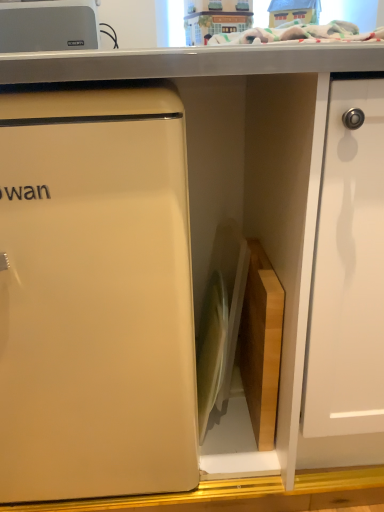
Describe the element at coordinates (215, 18) in the screenshot. Image resolution: width=384 pixels, height=512 pixels. I see `matte plastic toy house at upper center` at that location.

The image size is (384, 512). I want to click on silver metallic toaster at upper left, the 2th appliance positioned from the right, so click(48, 26).

Where is `matte plastic toy house at upper center`? Image resolution: width=384 pixels, height=512 pixels. matte plastic toy house at upper center is located at coordinates (215, 18).

Considering the sizes of matte white refrigerator at left and silver metallic toaster at upper left, which ranks as the first appliance in top-to-bottom order, in the image, is matte white refrigerator at left wider or thinner than silver metallic toaster at upper left, which ranks as the first appliance in top-to-bottom order,?

matte white refrigerator at left is wider than silver metallic toaster at upper left, which ranks as the first appliance in top-to-bottom order.

Which is nearer, (181,130) or (84,3)?

Positioned in front is point (181,130).

Considering the sizes of matte white refrigerator at left and silver metallic toaster at upper left, which ranks as the first appliance in top-to-bottom order, in the image, is matte white refrigerator at left bigger or smaller than silver metallic toaster at upper left, which ranks as the first appliance in top-to-bottom order,?

matte white refrigerator at left is bigger than silver metallic toaster at upper left, which ranks as the first appliance in top-to-bottom order.

Is matte white refrigerator at left further to the viewer compared to silver metallic toaster at upper left, the second appliance in the bottom-to-top sequence?

No, it is in front of silver metallic toaster at upper left, the second appliance in the bottom-to-top sequence.

From the image's perspective, is matte plastic toy house at upper center under matte white refrigerator at left?

No.

At what (x,y) coordinates should I click in order to perform the action: click on toy above the matte white refrigerator at left (from the image's perspective). Please return your answer as a coordinate pair (x, y). Looking at the image, I should click on (215, 18).

Is matte plastic toy house at upper center not within matte white refrigerator at left?

Yes.

Where is `refrigerator above the white glossy cutting board at center, the 2th appliance positioned from the left (from the image's perspective)`? The image size is (384, 512). refrigerator above the white glossy cutting board at center, the 2th appliance positioned from the left (from the image's perspective) is located at coordinates (95, 296).

Considering the relative sizes of matte white refrigerator at left and white glossy cutting board at center, which appears as the first appliance when ordered from the bottom, in the image provided, is matte white refrigerator at left shorter than white glossy cutting board at center, which appears as the first appliance when ordered from the bottom,?

Incorrect, the height of matte white refrigerator at left does not fall short of that of white glossy cutting board at center, which appears as the first appliance when ordered from the bottom.

Considering the sizes of objects matte white refrigerator at left and white glossy cutting board at center, the 2th appliance positioned from the top, in the image provided, who is bigger, matte white refrigerator at left or white glossy cutting board at center, the 2th appliance positioned from the top,?

With larger size is matte white refrigerator at left.

Which object is further away from the camera, white glossy cutting board at center, the 2th appliance positioned from the top, or silver metallic toaster at upper left, which ranks as the first appliance in top-to-bottom order?

silver metallic toaster at upper left, which ranks as the first appliance in top-to-bottom order, is more distant.

How different are the orientations of white glossy cutting board at center, the 2th appliance positioned from the top, and silver metallic toaster at upper left, the 2th appliance positioned from the right, in degrees?

0.103 degrees.

Is white glossy cutting board at center, the 2th appliance positioned from the top, bigger or smaller than silver metallic toaster at upper left, which ranks as the first appliance in top-to-bottom order?

In the image, white glossy cutting board at center, the 2th appliance positioned from the top, appears to be larger than silver metallic toaster at upper left, which ranks as the first appliance in top-to-bottom order.

From a real-world perspective, is white glossy cutting board at center, acting as the first appliance starting from the right, on silver metallic toaster at upper left, the second appliance in the bottom-to-top sequence?

Actually, white glossy cutting board at center, acting as the first appliance starting from the right, is physically below silver metallic toaster at upper left, the second appliance in the bottom-to-top sequence, in the real world.

Is point (211, 29) in front of point (240, 286)?

No, (211, 29) is further to viewer.

Which of these two, matte plastic toy house at upper center or white glossy cutting board at center, which appears as the first appliance when ordered from the bottom, stands shorter?

Standing shorter between the two is matte plastic toy house at upper center.

Considering the sizes of matte plastic toy house at upper center and white glossy cutting board at center, which appears as the first appliance when ordered from the bottom, in the image, is matte plastic toy house at upper center wider or thinner than white glossy cutting board at center, which appears as the first appliance when ordered from the bottom,?

In the image, matte plastic toy house at upper center appears to be more narrow than white glossy cutting board at center, which appears as the first appliance when ordered from the bottom.

In the image, is matte plastic toy house at upper center positioned in front of or behind silver metallic toaster at upper left, which ranks as the first appliance in top-to-bottom order?

Clearly, matte plastic toy house at upper center is behind silver metallic toaster at upper left, which ranks as the first appliance in top-to-bottom order.

Is matte plastic toy house at upper center positioned far away from silver metallic toaster at upper left, the second appliance in the bottom-to-top sequence?

matte plastic toy house at upper center is near silver metallic toaster at upper left, the second appliance in the bottom-to-top sequence, not far away.

Does point (199, 39) appear closer or farther from the camera than point (1, 41)?

Point (199, 39) appears to be farther away from the viewer than point (1, 41).

Can you confirm if matte plastic toy house at upper center is thinner than silver metallic toaster at upper left, the first appliance in the left-to-right sequence?

No, matte plastic toy house at upper center is not thinner than silver metallic toaster at upper left, the first appliance in the left-to-right sequence.

From the image's perspective, who appears lower, silver metallic toaster at upper left, the first appliance in the left-to-right sequence, or matte white refrigerator at left?

From the image's view, matte white refrigerator at left is below.

Which of these two, silver metallic toaster at upper left, which ranks as the first appliance in top-to-bottom order, or matte white refrigerator at left, stands shorter?

With less height is silver metallic toaster at upper left, which ranks as the first appliance in top-to-bottom order.

Which point is more forward, [41,34] or [144,169]?

The point [144,169] is in front.

At what (x,y) coordinates should I click in order to perform the action: click on refrigerator that is under the silver metallic toaster at upper left, the first appliance in the left-to-right sequence (from a real-world perspective). Please return your answer as a coordinate pair (x, y). The height and width of the screenshot is (512, 384). Looking at the image, I should click on (95, 296).

You are a GUI agent. You are given a task and a screenshot of the screen. Output one action in this format:
    pyautogui.click(x=<x>, y=<y>)
    Task: Click on the toy above the matte white refrigerator at left (from the image's perspective)
    Image resolution: width=384 pixels, height=512 pixels.
    Given the screenshot: What is the action you would take?
    pyautogui.click(x=215, y=18)

Which object lies further to the anchor point matte white refrigerator at left, matte plastic toy house at upper center or white glossy cutting board at center, the 2th appliance positioned from the top?

The object further to matte white refrigerator at left is matte plastic toy house at upper center.

Based on their spatial positions, is matte white refrigerator at left or matte plastic toy house at upper center further from silver metallic toaster at upper left, which ranks as the first appliance in top-to-bottom order?

matte white refrigerator at left is further to silver metallic toaster at upper left, which ranks as the first appliance in top-to-bottom order.

When comparing their distances from white glossy cutting board at center, the 2th appliance positioned from the left, does silver metallic toaster at upper left, the 2th appliance positioned from the right, or matte plastic toy house at upper center seem further?

silver metallic toaster at upper left, the 2th appliance positioned from the right, is further to white glossy cutting board at center, the 2th appliance positioned from the left.

Based on the photo, considering their positions, is matte white refrigerator at left positioned further to matte plastic toy house at upper center than white glossy cutting board at center, acting as the first appliance starting from the right?

The object further to matte plastic toy house at upper center is matte white refrigerator at left.

From the image, which object appears to be farther from matte white refrigerator at left, white glossy cutting board at center, the 2th appliance positioned from the left, or silver metallic toaster at upper left, the first appliance in the left-to-right sequence?

silver metallic toaster at upper left, the first appliance in the left-to-right sequence, is positioned further to the anchor matte white refrigerator at left.

Considering their positions, is silver metallic toaster at upper left, the second appliance in the bottom-to-top sequence, positioned further to matte plastic toy house at upper center than white glossy cutting board at center, acting as the first appliance starting from the right?

The object further to matte plastic toy house at upper center is white glossy cutting board at center, acting as the first appliance starting from the right.

Estimate the real-world distances between objects in this image. Which object is closer to matte white refrigerator at left, matte plastic toy house at upper center or silver metallic toaster at upper left, the first appliance in the left-to-right sequence?

silver metallic toaster at upper left, the first appliance in the left-to-right sequence, is positioned closer to the anchor matte white refrigerator at left.

Considering their positions, is matte plastic toy house at upper center positioned closer to white glossy cutting board at center, acting as the first appliance starting from the right, than silver metallic toaster at upper left, the first appliance in the left-to-right sequence?

Among the two, matte plastic toy house at upper center is located nearer to white glossy cutting board at center, acting as the first appliance starting from the right.

You are a GUI agent. You are given a task and a screenshot of the screen. Output one action in this format:
    pyautogui.click(x=<x>, y=<y>)
    Task: Click on the refrigerator between matte plastic toy house at upper center and white glossy cutting board at center, which appears as the first appliance when ordered from the bottom, in the vertical direction
    The height and width of the screenshot is (512, 384).
    Given the screenshot: What is the action you would take?
    pyautogui.click(x=95, y=296)

Identify the location of refrigerator between silver metallic toaster at upper left, the 2th appliance positioned from the right, and white glossy cutting board at center, which appears as the first appliance when ordered from the bottom, vertically. This screenshot has height=512, width=384. (95, 296).

The image size is (384, 512). What are the coordinates of `appliance between matte plastic toy house at upper center and matte white refrigerator at left from top to bottom` in the screenshot? It's located at (48, 26).

At what (x,y) coordinates should I click in order to perform the action: click on appliance between matte plastic toy house at upper center and white glossy cutting board at center, which appears as the first appliance when ordered from the bottom, from top to bottom. Please return your answer as a coordinate pair (x, y). The height and width of the screenshot is (512, 384). Looking at the image, I should click on (48, 26).